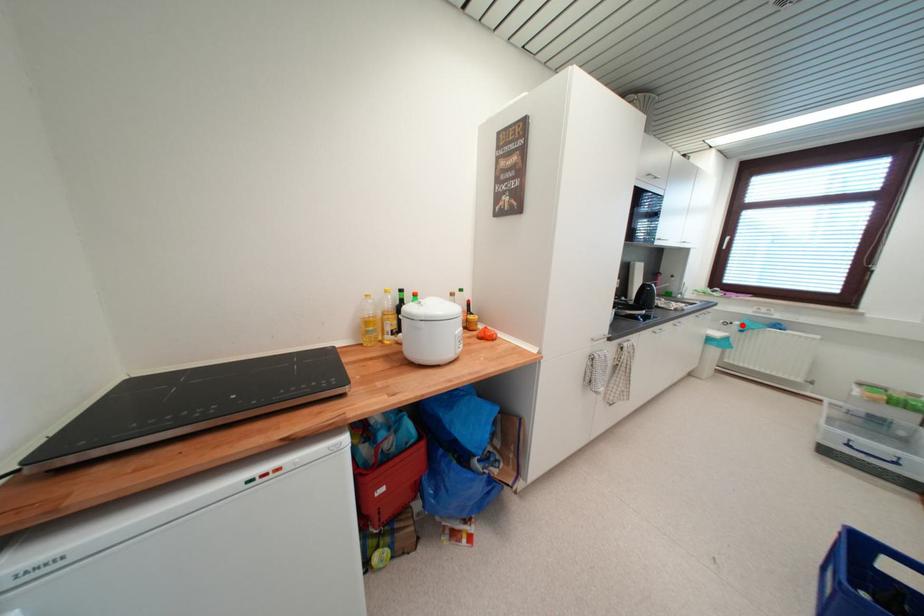
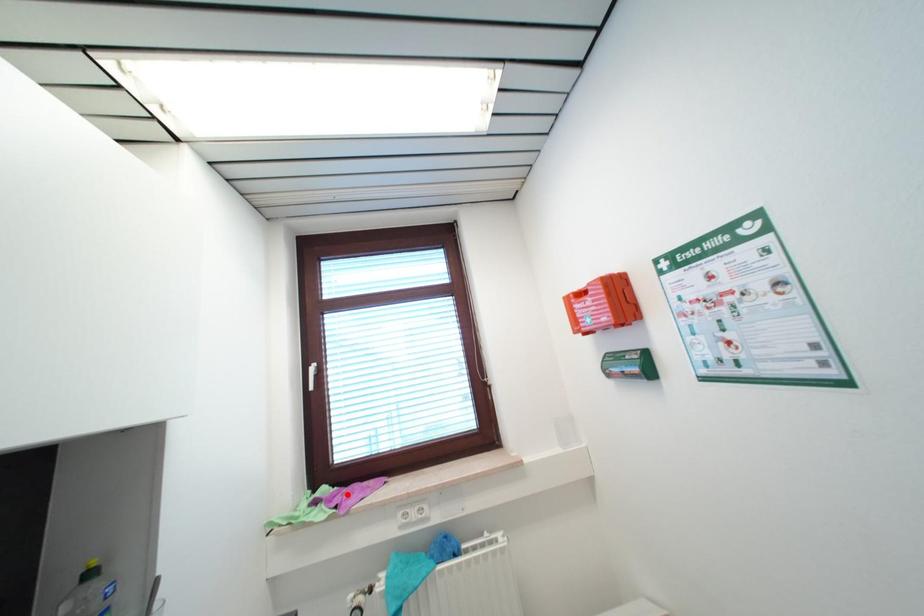
I am providing you with two images of the same scene from different viewpoints. A red point is marked on the first image and another point is marked on the second image. Is the marked point in image1 the same physical position as the marked point in image2?

No